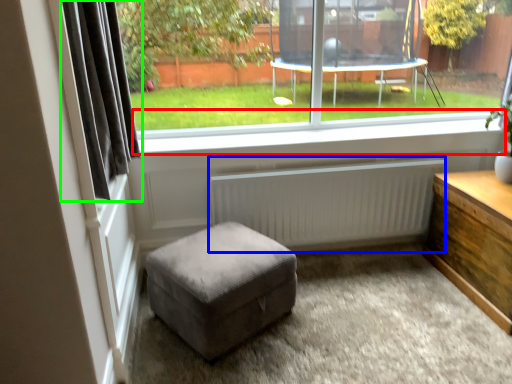
Question: Which is nearer to the window sill (highlighted by a red box)? radiator (highlighted by a blue box) or curtain (highlighted by a green box).

Choices:
 (A) radiator
 (B) curtain

Answer: (A)